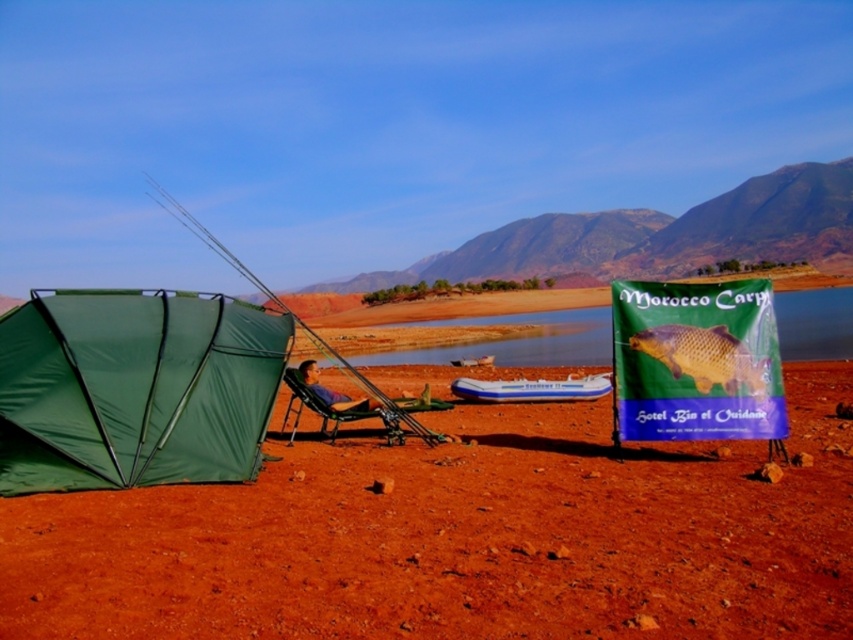
Question: Can you confirm if golden textured fish at center is positioned to the right of metallic silver chair at center?

Choices:
 (A) yes
 (B) no

Answer: (A)

Question: Among these points, which one is nearest to the camera?

Choices:
 (A) (474, 556)
 (B) (288, 371)

Answer: (A)

Question: Can you confirm if dirt field at lower center is positioned above metallic silver chair at center?

Choices:
 (A) no
 (B) yes

Answer: (B)

Question: Which of these objects is positioned farthest from the metallic silver chair at center?

Choices:
 (A) blue inflatable boat at center
 (B) green fabric fishing pole at left
 (C) green fabric tent at left
 (D) golden textured fish at center

Answer: (B)

Question: Is green fabric tent at left thinner than green fabric fishing pole at left?

Choices:
 (A) no
 (B) yes

Answer: (B)

Question: Which point is closer to the camera taking this photo?

Choices:
 (A) (332, 406)
 (B) (688, 362)
 (C) (376, 397)

Answer: (B)